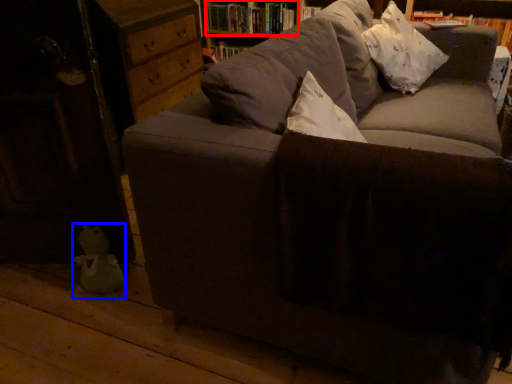
Question: Among these objects, which one is farthest to the camera, book (highlighted by a red box) or toy (highlighted by a blue box)?

Choices:
 (A) book
 (B) toy

Answer: (A)